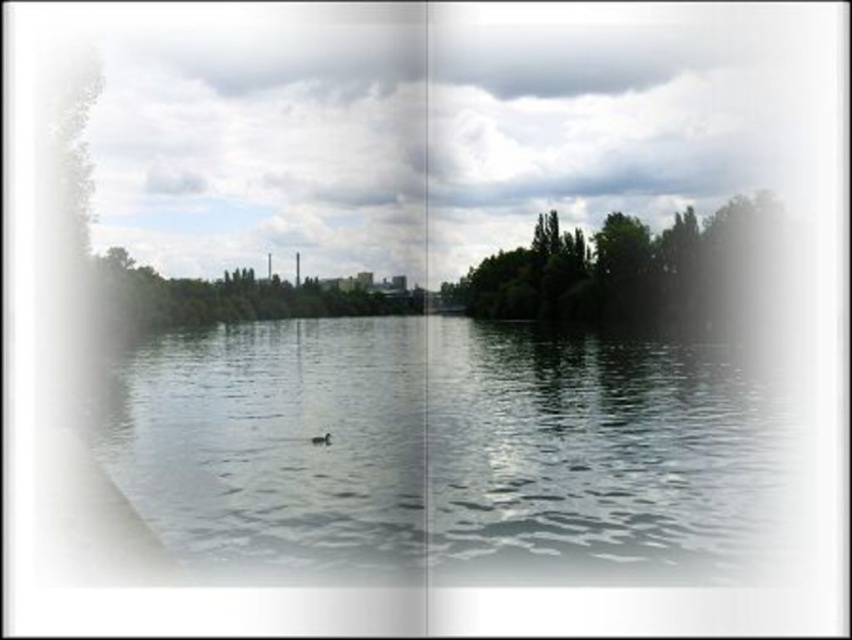
Question: Can you confirm if clear water at center is positioned to the left of green leafy tree at center?

Choices:
 (A) no
 (B) yes

Answer: (A)

Question: Considering the relative positions of clear water at center and brown matte duck at center in the image provided, where is clear water at center located with respect to brown matte duck at center?

Choices:
 (A) below
 (B) above

Answer: (B)

Question: Estimate the real-world distances between objects in this image. Which object is farther from the green leafy trees at center?

Choices:
 (A) brown matte duck at center
 (B) clear water at center

Answer: (A)

Question: Which point is farther from the camera taking this photo?

Choices:
 (A) (329, 433)
 (B) (596, 241)

Answer: (B)

Question: Which point is farther from the camera taking this photo?

Choices:
 (A) (683, 232)
 (B) (694, 568)
 (C) (326, 442)
 (D) (234, 289)

Answer: (D)

Question: Is green leafy trees at center further to the viewer compared to brown matte duck at center?

Choices:
 (A) no
 (B) yes

Answer: (B)